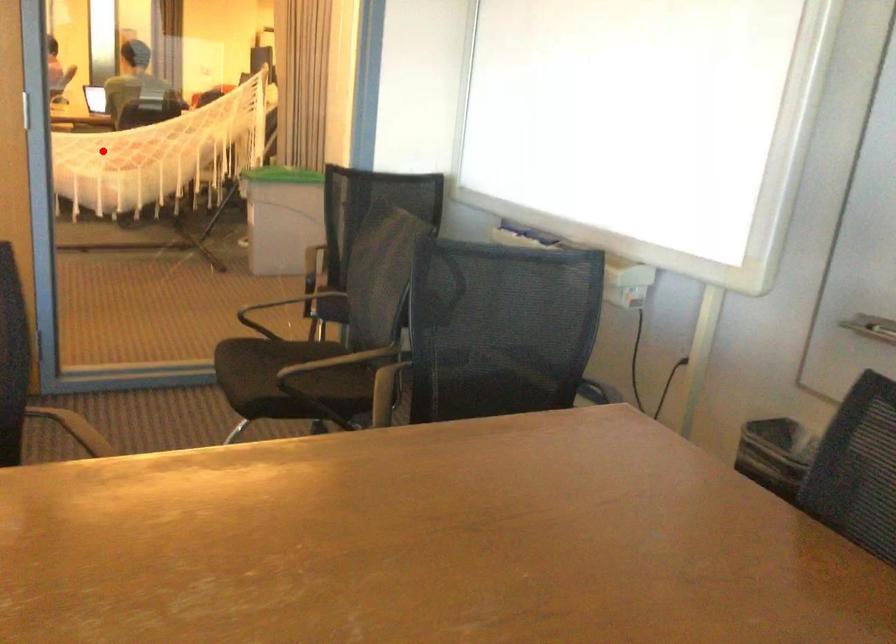
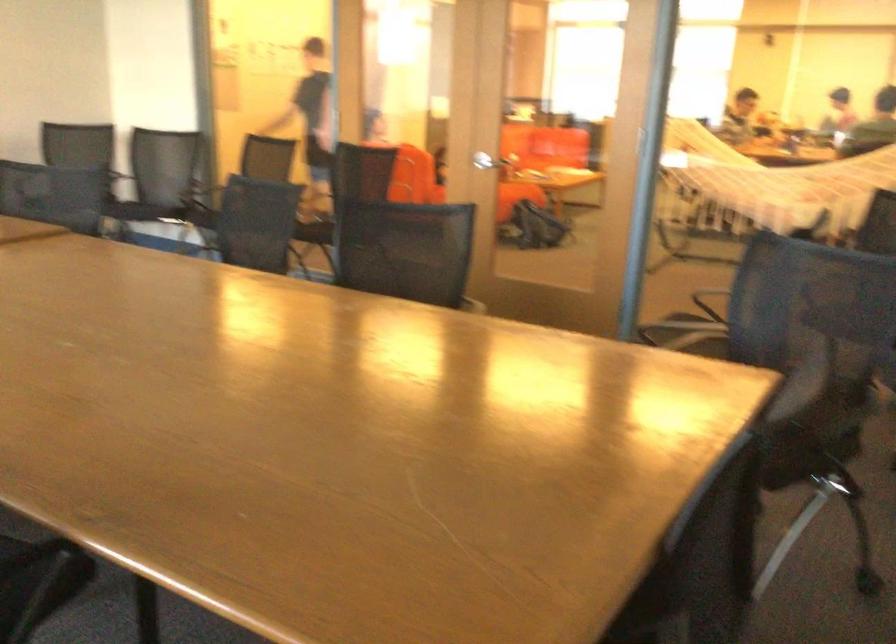
Question: I am providing you with two images of the same scene from different viewpoints. A red point is shown in image1. For the corresponding object point in image2, is it positioned nearer or farther from the camera?

Choices:
 (A) Nearer
 (B) Farther

Answer: (B)